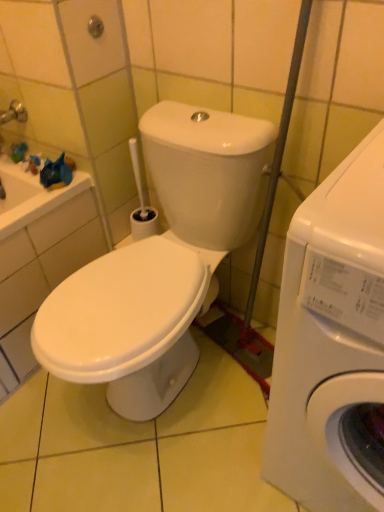
Question: Is white glossy washing machine at right, positioned as the 1th washing machine in left-to-right order, smaller than green rubber shower at upper left?

Choices:
 (A) no
 (B) yes

Answer: (A)

Question: Is white glossy washing machine at right, positioned as the 1th washing machine in left-to-right order, next to green rubber shower at upper left and touching it?

Choices:
 (A) yes
 (B) no

Answer: (B)

Question: Is white glossy washing machine at right, arranged as the second washing machine when viewed from the right, to the left of green rubber shower at upper left from the viewer's perspective?

Choices:
 (A) no
 (B) yes

Answer: (A)

Question: From the image's perspective, is white glossy washing machine at right, positioned as the 1th washing machine in left-to-right order, located beneath green rubber shower at upper left?

Choices:
 (A) yes
 (B) no

Answer: (A)

Question: From a real-world perspective, is white glossy washing machine at right, positioned as the 1th washing machine in left-to-right order, under green rubber shower at upper left?

Choices:
 (A) yes
 (B) no

Answer: (A)

Question: Is point (97, 28) closer or farther from the camera than point (377, 489)?

Choices:
 (A) farther
 (B) closer

Answer: (A)

Question: Considering the positions of green rubber shower at upper left and white glossy washing machine at right, which ranks as the second washing machine in left-to-right order, in the image, is green rubber shower at upper left wider or thinner than white glossy washing machine at right, which ranks as the second washing machine in left-to-right order,?

Choices:
 (A) thin
 (B) wide

Answer: (A)

Question: Based on their positions, is green rubber shower at upper left located to the left or right of white glossy washing machine at right, which is counted as the 1th washing machine, starting from the right?

Choices:
 (A) right
 (B) left

Answer: (B)

Question: Based on their sizes in the image, would you say green rubber shower at upper left is bigger or smaller than white glossy washing machine at right, which ranks as the second washing machine in left-to-right order?

Choices:
 (A) small
 (B) big

Answer: (A)

Question: Based on their sizes in the image, would you say green rubber shower at upper left is bigger or smaller than white glossy washing machine at right, arranged as the second washing machine when viewed from the right?

Choices:
 (A) big
 (B) small

Answer: (B)

Question: In the image, is green rubber shower at upper left positioned in front of or behind white glossy washing machine at right, positioned as the 1th washing machine in left-to-right order?

Choices:
 (A) front
 (B) behind

Answer: (B)

Question: Based on their positions, is green rubber shower at upper left located to the left or right of white glossy washing machine at right, positioned as the 1th washing machine in left-to-right order?

Choices:
 (A) right
 (B) left

Answer: (B)

Question: From the image's perspective, is green rubber shower at upper left located above or below white glossy washing machine at right, arranged as the second washing machine when viewed from the right?

Choices:
 (A) below
 (B) above

Answer: (B)

Question: From the image's perspective, is white glossy washing machine at right, arranged as the second washing machine when viewed from the right, above or below green rubber shower at upper left?

Choices:
 (A) above
 (B) below

Answer: (B)

Question: From their relative heights in the image, would you say white glossy washing machine at right, positioned as the 1th washing machine in left-to-right order, is taller or shorter than green rubber shower at upper left?

Choices:
 (A) tall
 (B) short

Answer: (A)